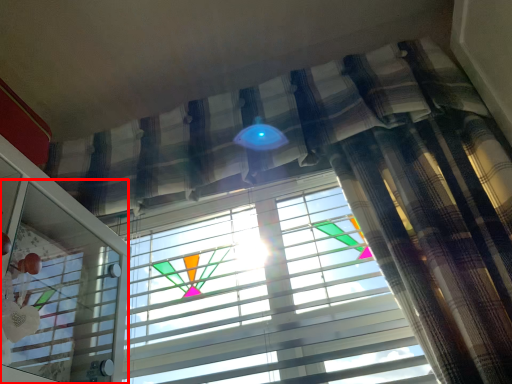
Question: Where is screen door (annotated by the red box) located in relation to window blind in the image?

Choices:
 (A) right
 (B) left

Answer: (B)